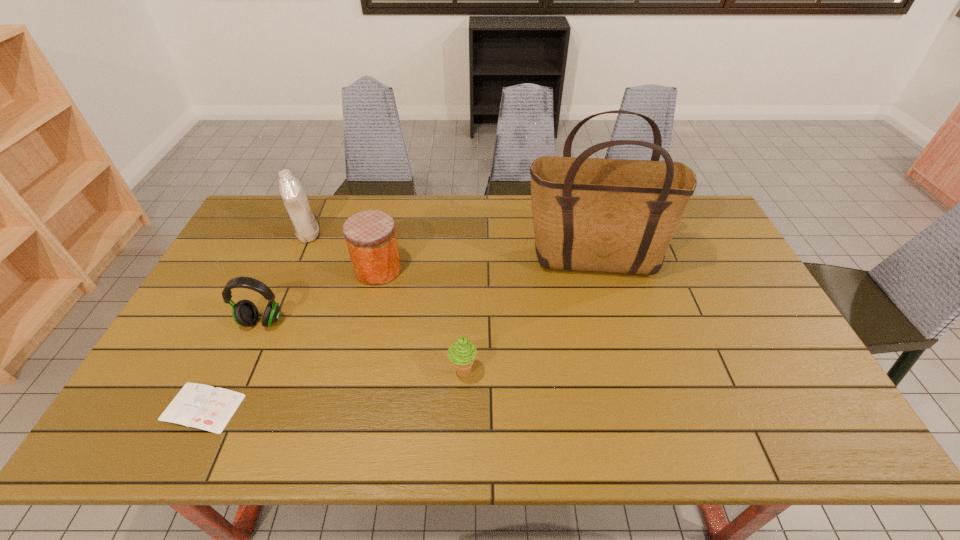
Where is `the rightmost object`? the rightmost object is located at coordinates (591, 214).

Where is `the tallest object`? This screenshot has height=540, width=960. the tallest object is located at coordinates (591, 214).

Find the location of a particular element. The height and width of the screenshot is (540, 960). detergent is located at coordinates (297, 206).

Locate an element on the screen. The image size is (960, 540). jar is located at coordinates (370, 235).

The image size is (960, 540). Identify the location of headset. (245, 313).

You are a GUI agent. You are given a task and a screenshot of the screen. Output one action in this format:
    pyautogui.click(x=<x>, y=<y>)
    Task: Click on the second object from right to left
    This screenshot has width=960, height=540.
    Given the screenshot: What is the action you would take?
    pyautogui.click(x=462, y=353)

At what (x,y) coordinates should I click in order to perform the action: click on the shortest object. Please return your answer as a coordinate pair (x, y). This screenshot has height=540, width=960. Looking at the image, I should click on (205, 407).

Find the location of a particular element. This screenshot has width=960, height=540. vacant space located 0.050m on the back of the rightmost object is located at coordinates (584, 233).

Find the location of a particular element. The width and height of the screenshot is (960, 540). free space located 0.330m on the front of the second tallest object is located at coordinates (269, 323).

Locate an element on the screen. The height and width of the screenshot is (540, 960). free point located 0.250m on the back of the jar is located at coordinates (393, 207).